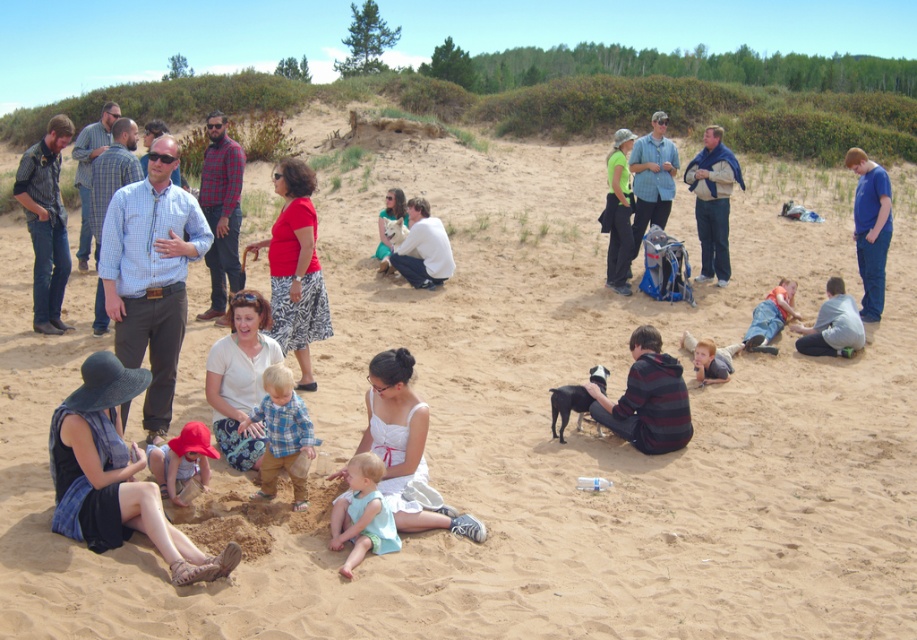
Question: Considering the relative positions of plaid shirt at center and blue plaid shirt at center in the image provided, where is plaid shirt at center located with respect to blue plaid shirt at center?

Choices:
 (A) right
 (B) left

Answer: (B)

Question: Does plaid shirt at center appear on the left side of blue cotton shirt at right?

Choices:
 (A) no
 (B) yes

Answer: (B)

Question: Which object is the closest to the plaid shirt at center?

Choices:
 (A) blue scarf at center
 (B) plaid flannel shirt at center

Answer: (B)

Question: Where is denim shirt at left located in relation to blue scarf at center in the image?

Choices:
 (A) below
 (B) above

Answer: (A)

Question: Among these points, which one is nearest to the camera?

Choices:
 (A) (43, 189)
 (B) (212, 157)
 (C) (869, 161)

Answer: (A)

Question: Which object is closer to the camera taking this photo?

Choices:
 (A) light blue fabric at center
 (B) denim shirt at left

Answer: (A)